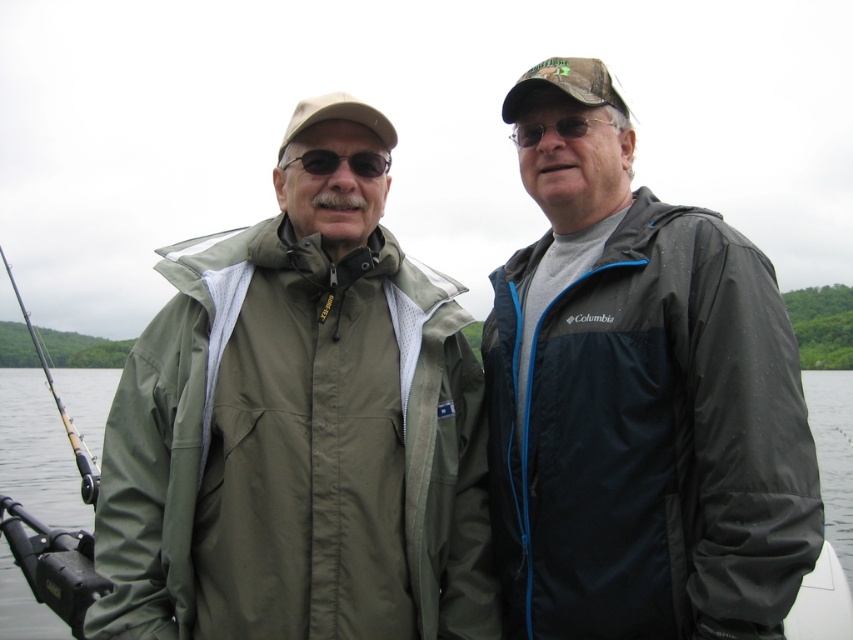
You are planning to cast your fishing pole into the water. Based on the scene, can you determine if the matte black fishing pole at left is positioned over the transparent water at center?

The transparent water at center is positioned under the matte black fishing pole at left, so yes, the fishing pole is positioned over the water.

You are planning to cast a fishing line from the matte black fishing pole at left into the transparent water at center. Considering their relative heights, can you safely lower the fishing pole without hitting anything?

The transparent water at center is shorter than the matte black fishing pole at left, so lowering the fishing pole might cause it to hit the water surface since the pole is taller than the water area.

Consider the image. You are standing at the point with coordinates point (352, 156) and want to walk to the point with coordinates point (20, 496). Is the destination point behind you or in front of you?

The destination point point (20, 496) is behind point (352, 156), so it is behind you.